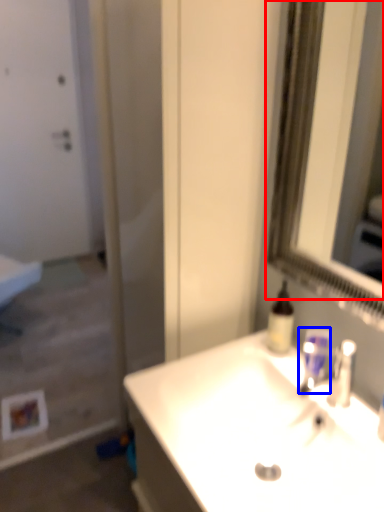
Question: Which of the following is the farthest to the observer, mirror (highlighted by a red box) or mouthwash (highlighted by a blue box)?

Choices:
 (A) mirror
 (B) mouthwash

Answer: (B)